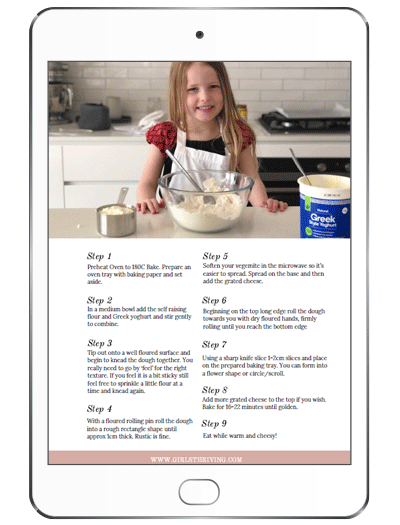
You are a GUI agent. You are given a task and a screenshot of the screen. Output one action in this format:
    pyautogui.click(x=<x>, y=<y>)
    Task: Click on the phone home button
    Image resolution: width=400 pixels, height=525 pixels.
    Given the screenshot: What is the action you would take?
    pyautogui.click(x=201, y=500)